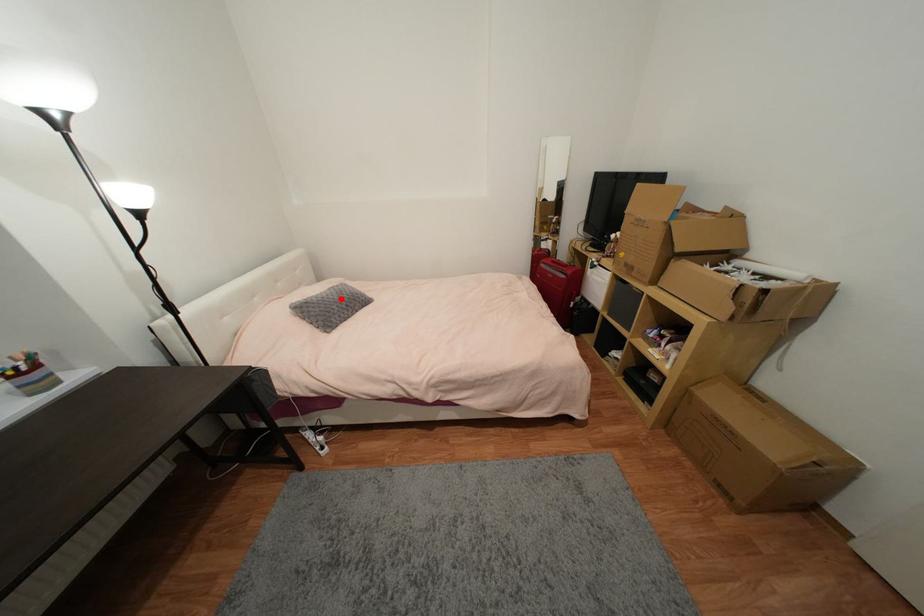
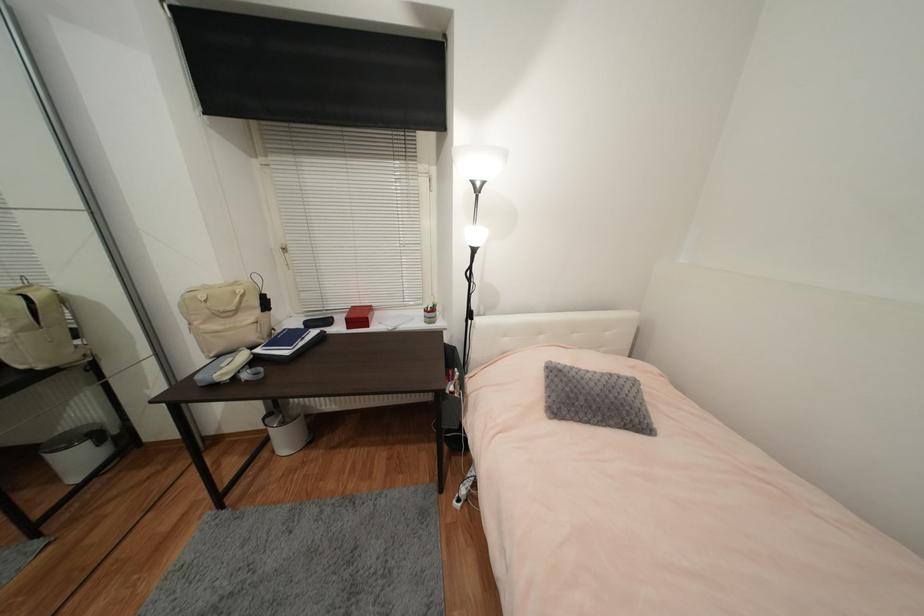
In the second image, find the point that corresponds to the highlighted location in the first image.

(602, 391)